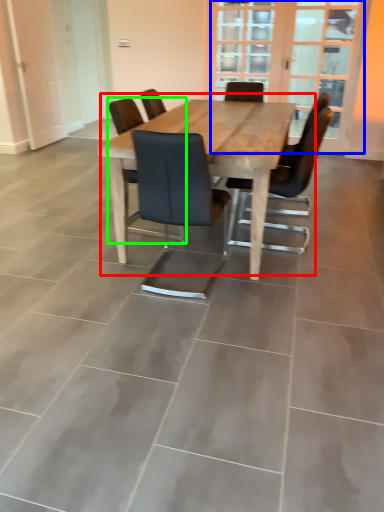
Question: Which object is the farthest from kitchen & dining room table (highlighted by a red box)? Choose among these: screen door (highlighted by a blue box) or chair (highlighted by a green box).

Choices:
 (A) screen door
 (B) chair

Answer: (A)